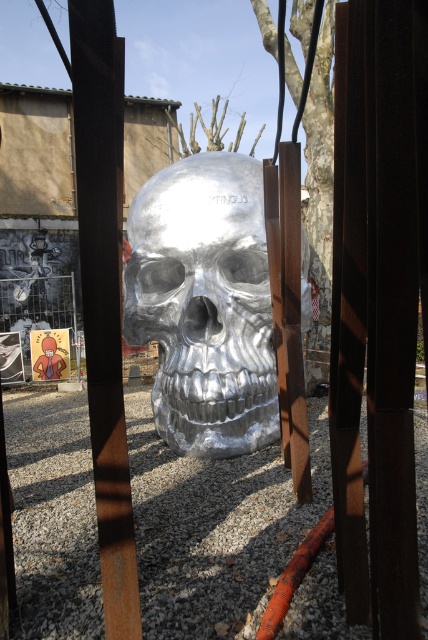
You are an artist planning to photograph the rusty metal pole at center and the brushed metal fence at center. To ensure both are in frame, you need to know their positions relative to each other. Which object is located to the right of the other?

The rusty metal pole at center is positioned on the right side of the brushed metal fence at center, so the rusty metal pole at center is to the right of the brushed metal fence at center.

You are an artist planning to photograph the brushed metal fence at center and the brushed metal person at lower left. You want to ensure both are fully visible in the frame. Given that your camera can only capture a width of 2 meters, will you be able to fit both objects side by side?

The brushed metal fence at center is wider than the brushed metal person at lower left. Since the fence is wider, the total combined width of both objects might exceed the camera frame width of 2 meters. To determine if they fit, you need to know their exact widths. However, based on the information provided, we only know the fence is wider than the person. Without specific measurements, it is uncertain if both will fit within 2 meters.